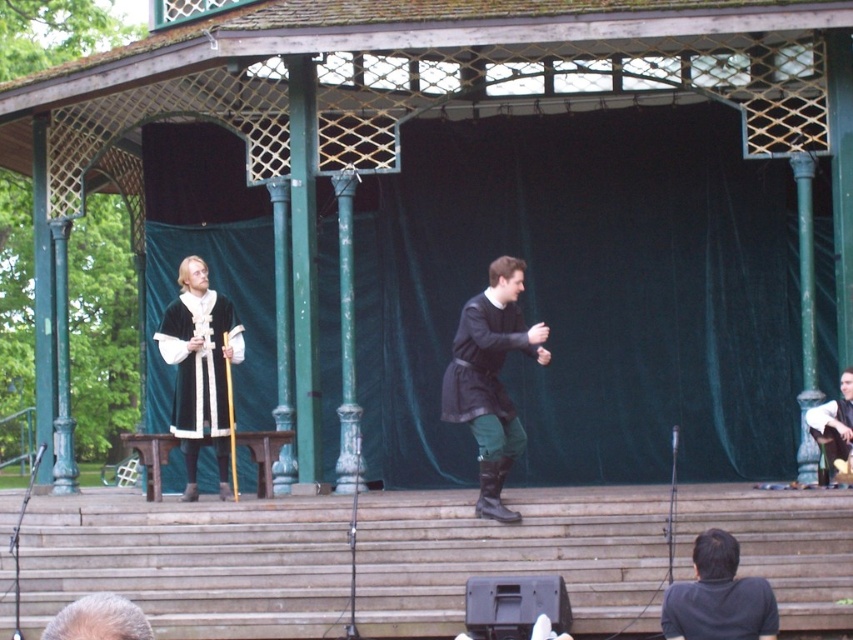
Is the position of velvet black robe at center more distant than that of smooth brown leather jacket at right?

→ Yes, velvet black robe at center is further from the viewer.

Measure the distance from velvet black robe at center to smooth brown leather jacket at right.

They are 42.78 feet apart.

What do you see at coordinates (200, 368) in the screenshot? I see `velvet black robe at center` at bounding box center [200, 368].

This screenshot has width=853, height=640. I want to click on velvet black robe at center, so [x=200, y=368].

Is matte black tunic at center closer to the viewer compared to velvet black robe at center?

Yes, it is in front of velvet black robe at center.

Between matte black tunic at center and velvet black robe at center, which one is positioned higher?

matte black tunic at center is higher up.

Locate an element on the screen. This screenshot has width=853, height=640. matte black tunic at center is located at coordinates (490, 378).

Which is in front, point (485, 515) or point (821, 429)?

Point (485, 515) is more forward.

Between point (456, 412) and point (850, 416), which one is positioned behind?

Point (850, 416)

Is point (498, 301) positioned before point (845, 392)?

Yes.

Where is `matte black tunic at center`? The height and width of the screenshot is (640, 853). matte black tunic at center is located at coordinates (490, 378).